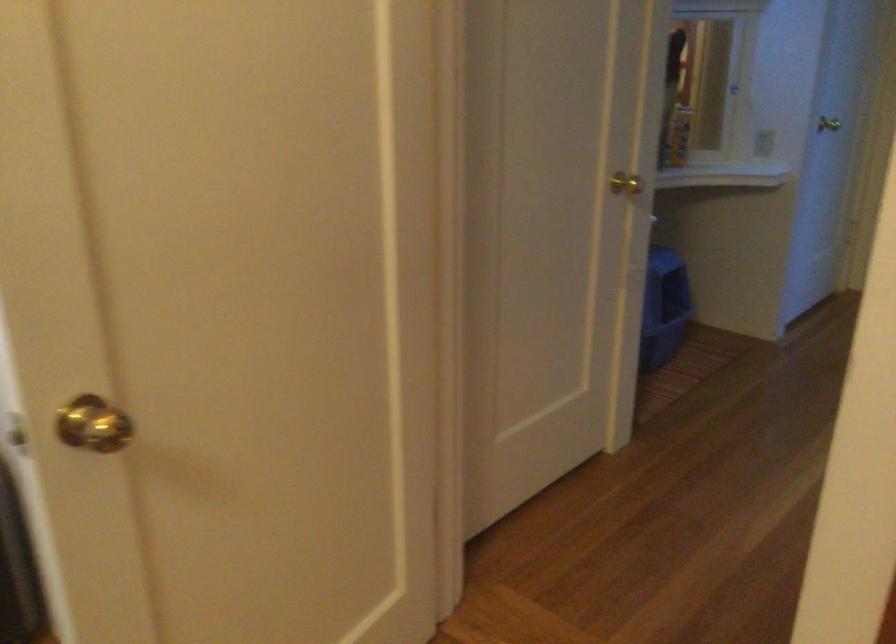
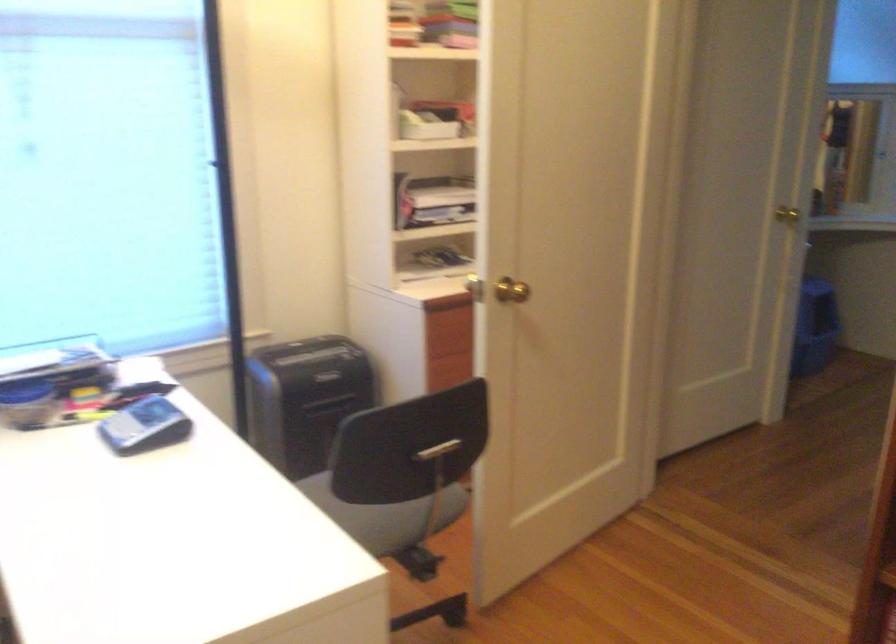
Find the pixel in the second image that matches point 625,181 in the first image.

(787, 214)